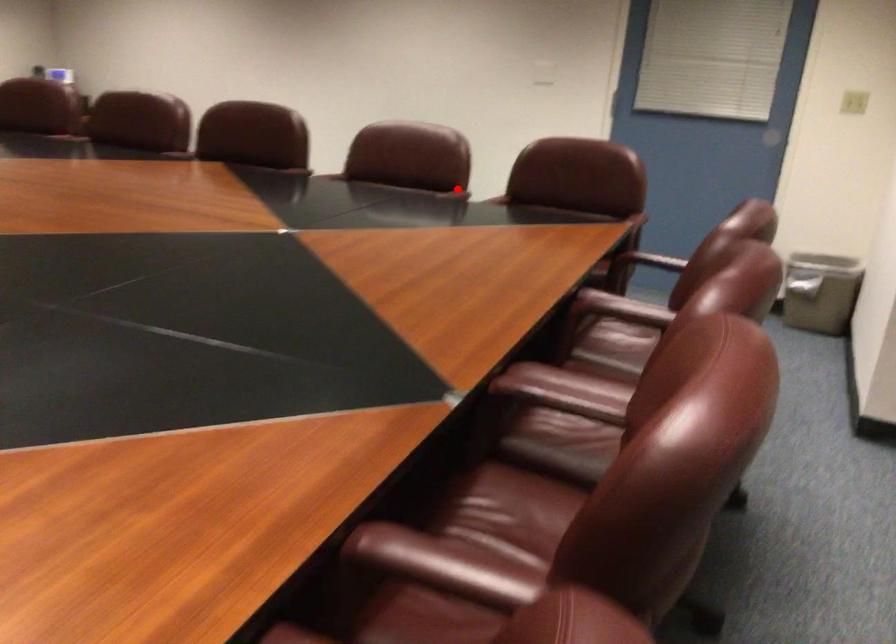
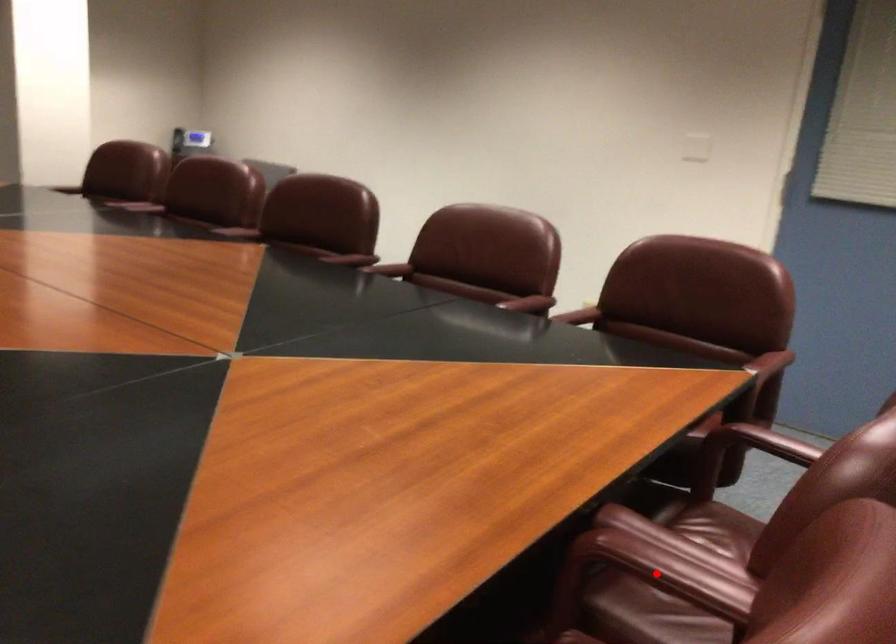
I am providing you with two images of the same scene from different viewpoints. A red point is marked on the first image and another point is marked on the second image. Do the highlighted points in image1 and image2 indicate the same real-world spot?

No